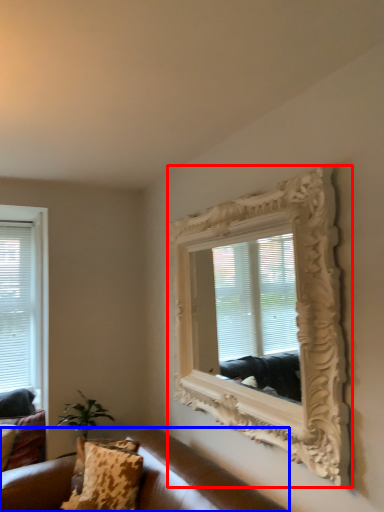
Question: Which object is further to the camera taking this photo, picture frame (highlighted by a red box) or studio couch (highlighted by a blue box)?

Choices:
 (A) picture frame
 (B) studio couch

Answer: (A)